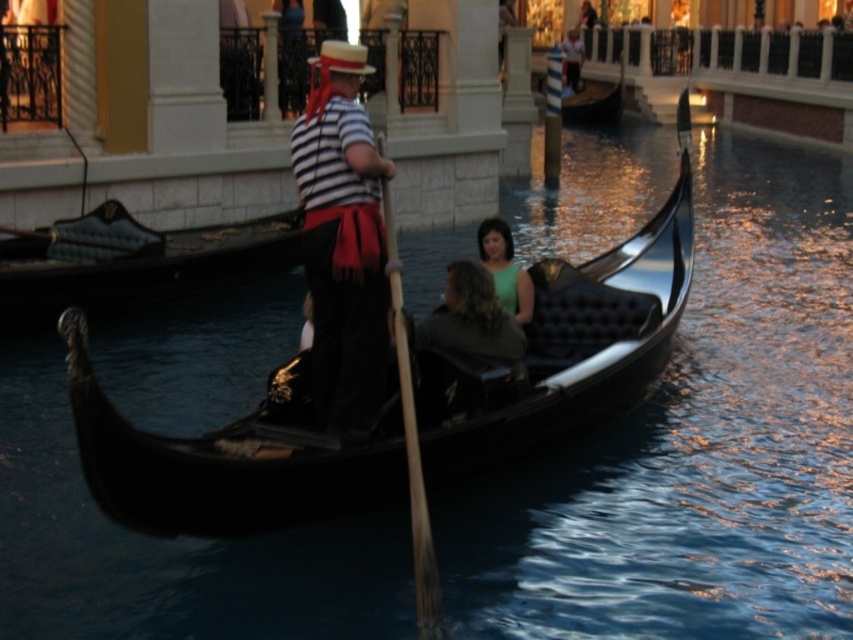
Measure the distance from shiny black gondola at center to green matte dress at center.

The distance of shiny black gondola at center from green matte dress at center is 5.21 meters.

Does point (241, 442) come behind point (521, 273)?

No.

Find the location of a particular element. The width and height of the screenshot is (853, 640). shiny black gondola at center is located at coordinates (566, 346).

Can you confirm if black polished wood gondola at center is positioned to the left of black glossy gondola at center?

Correct, you'll find black polished wood gondola at center to the left of black glossy gondola at center.

I want to click on black polished wood gondola at center, so click(x=131, y=260).

The height and width of the screenshot is (640, 853). What are the coordinates of `black polished wood gondola at center` in the screenshot? It's located at (131, 260).

In the scene shown: Between shiny black gondola at center and striped fabric shirt at center, which one has more height?

shiny black gondola at center is taller.

Image resolution: width=853 pixels, height=640 pixels. Describe the element at coordinates (566, 346) in the screenshot. I see `shiny black gondola at center` at that location.

Where is `shiny black gondola at center`? This screenshot has height=640, width=853. shiny black gondola at center is located at coordinates (566, 346).

You are a GUI agent. You are given a task and a screenshot of the screen. Output one action in this format:
    pyautogui.click(x=<x>, y=<y>)
    Task: Click on the shiny black gondola at center
    
    Given the screenshot: What is the action you would take?
    pyautogui.click(x=566, y=346)